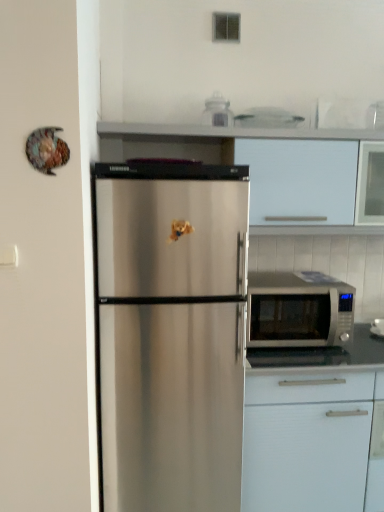
Question: Is silver metallic microwave at right thinner than white matte cabinet at lower right, acting as the 1th cabinetry starting from the bottom?

Choices:
 (A) no
 (B) yes

Answer: (B)

Question: From the image's perspective, would you say silver metallic microwave at right is positioned over white matte cabinet at lower right, acting as the 1th cabinetry starting from the bottom?

Choices:
 (A) no
 (B) yes

Answer: (B)

Question: From the image's perspective, is silver metallic microwave at right under white matte cabinet at lower right, acting as the 1th cabinetry starting from the bottom?

Choices:
 (A) yes
 (B) no

Answer: (B)

Question: Is silver metallic microwave at right closer to the viewer compared to white matte cabinet at lower right, the second cabinetry from the top?

Choices:
 (A) yes
 (B) no

Answer: (B)

Question: Is silver metallic microwave at right oriented towards white matte cabinet at lower right, acting as the 1th cabinetry starting from the bottom?

Choices:
 (A) no
 (B) yes

Answer: (A)

Question: Is point (302, 225) positioned closer to the camera than point (311, 419)?

Choices:
 (A) farther
 (B) closer

Answer: (A)

Question: Is white matte cabinet at upper center, placed as the second cabinetry when sorted from bottom to top, in front of or behind white matte cabinet at lower right, acting as the 1th cabinetry starting from the bottom, in the image?

Choices:
 (A) front
 (B) behind

Answer: (B)

Question: In the image, is white matte cabinet at upper center, placed as the second cabinetry when sorted from bottom to top, on the left side or the right side of white matte cabinet at lower right, acting as the 1th cabinetry starting from the bottom?

Choices:
 (A) left
 (B) right

Answer: (A)

Question: From a real-world perspective, is white matte cabinet at upper center, placed as the second cabinetry when sorted from bottom to top, physically located above or below white matte cabinet at lower right, acting as the 1th cabinetry starting from the bottom?

Choices:
 (A) above
 (B) below

Answer: (A)

Question: From the image's perspective, is silver metallic microwave at right above or below white matte cabinet at upper center, the first cabinetry viewed from the top?

Choices:
 (A) below
 (B) above

Answer: (A)

Question: Considering the positions of point (334, 295) and point (139, 122), is point (334, 295) closer or farther from the camera than point (139, 122)?

Choices:
 (A) farther
 (B) closer

Answer: (B)

Question: In terms of width, does silver metallic microwave at right look wider or thinner when compared to white matte cabinet at upper center, placed as the second cabinetry when sorted from bottom to top?

Choices:
 (A) thin
 (B) wide

Answer: (B)

Question: From a real-world perspective, is silver metallic microwave at right positioned above or below white matte cabinet at upper center, the first cabinetry viewed from the top?

Choices:
 (A) below
 (B) above

Answer: (A)

Question: Is silver metallic microwave at right inside the boundaries of white matte cabinet at lower right, the second cabinetry from the top, or outside?

Choices:
 (A) inside
 (B) outside

Answer: (B)

Question: Considering the positions of silver metallic microwave at right and white matte cabinet at lower right, the second cabinetry from the top, in the image, is silver metallic microwave at right wider or thinner than white matte cabinet at lower right, the second cabinetry from the top,?

Choices:
 (A) thin
 (B) wide

Answer: (A)